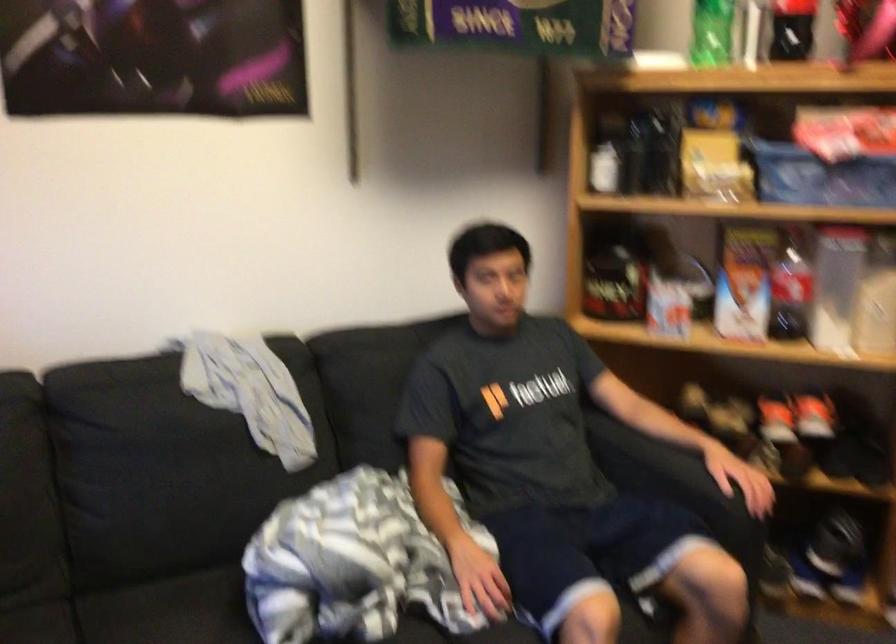
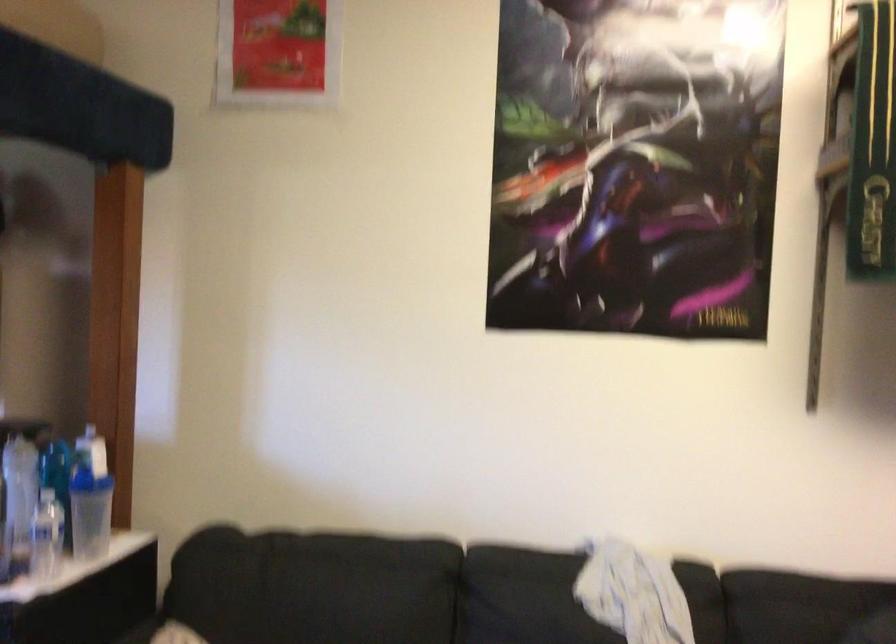
Question: The camera is either moving clockwise (left) or counter-clockwise (right) around the object. The first image is from the beginning of the video and the second image is from the end. Is the camera moving left or right when shooting the video?

Choices:
 (A) Left
 (B) Right

Answer: (B)